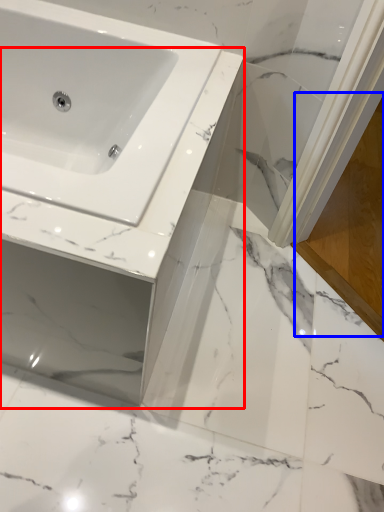
Question: Which point is further to the camera, counter top (highlighted by a red box) or screen door (highlighted by a blue box)?

Choices:
 (A) counter top
 (B) screen door

Answer: (B)